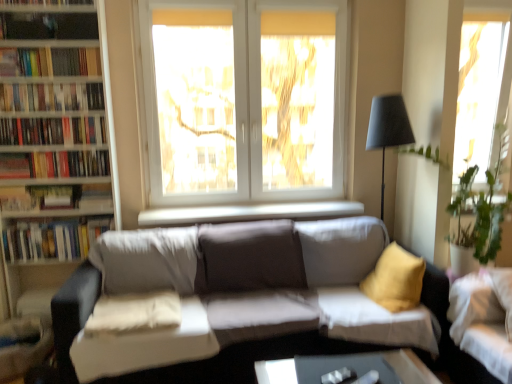
Find the location of `free space above matte black table at center (from a real-world perspective)`. free space above matte black table at center (from a real-world perspective) is located at coordinates (346, 374).